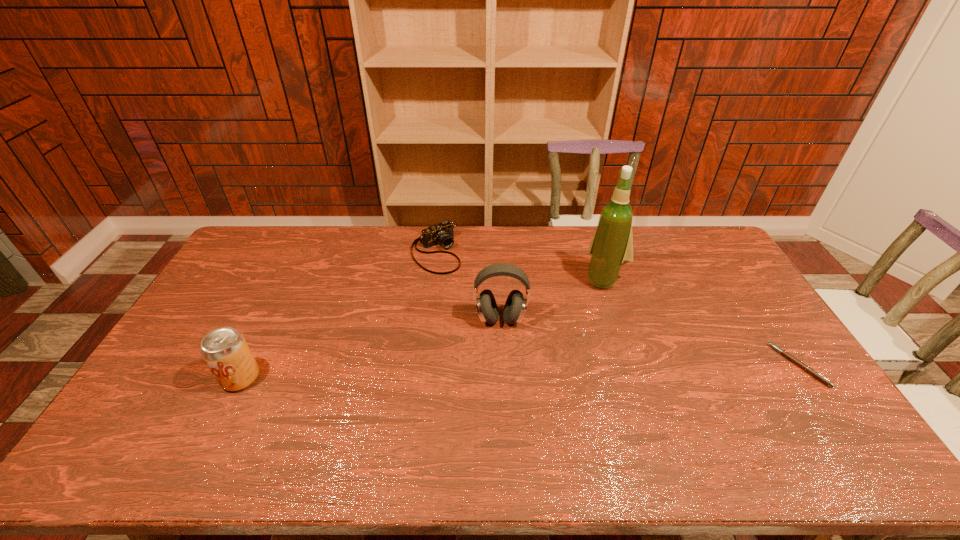
Find the location of a particular element. This screenshot has width=960, height=540. vacant space positioned on the right of the third tallest object is located at coordinates (377, 377).

Locate an element on the screen. Image resolution: width=960 pixels, height=540 pixels. free location located at the nib of the shortest object is located at coordinates (738, 365).

Where is `vacant region located at the nib of the shortest object`? vacant region located at the nib of the shortest object is located at coordinates (655, 365).

This screenshot has height=540, width=960. I want to click on free space located at the nib of the shortest object, so click(661, 365).

This screenshot has height=540, width=960. What are the coordinates of `free space located 0.280m on the front-facing side of the wine bottle` in the screenshot? It's located at (559, 342).

At what (x,y) coordinates should I click in order to perform the action: click on vacant space located on the front-facing side of the wine bottle. Please return your answer as a coordinate pair (x, y). This screenshot has height=540, width=960. Looking at the image, I should click on (583, 309).

Identify the location of free space located 0.140m on the front-facing side of the wine bottle. (579, 314).

I want to click on vacant position located 0.140m on the front-facing side of the second shortest object, so click(467, 294).

The image size is (960, 540). What are the coordinates of `blank space located 0.280m on the front-facing side of the second shortest object` in the screenshot? It's located at (489, 320).

Locate an element on the screen. vacant area situated on the front-facing side of the second shortest object is located at coordinates coord(464,291).